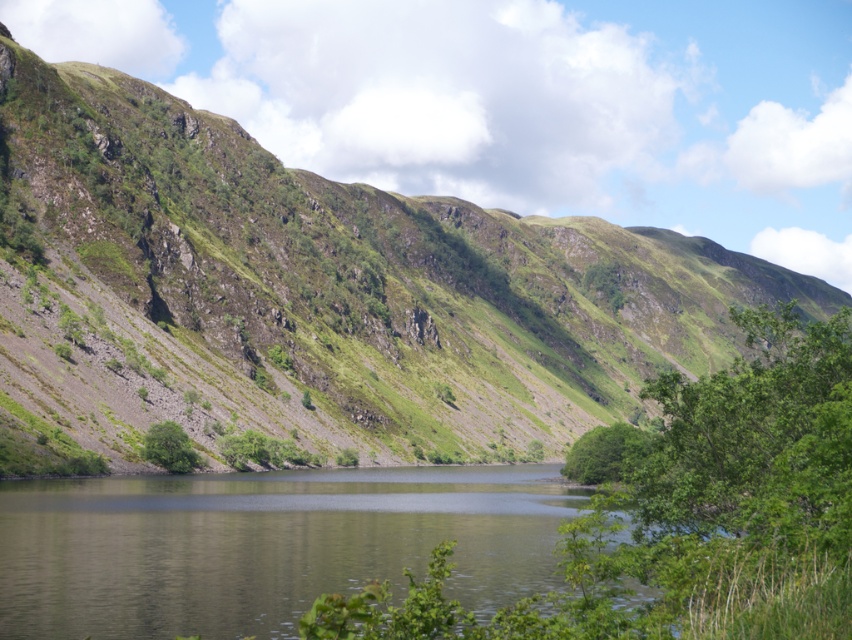
Is green grassy hillside at center closer to camera compared to green leafy tree at lower left?

That is True.

Locate an element on the screen. The width and height of the screenshot is (852, 640). green grassy hillside at center is located at coordinates (314, 296).

Which is in front, point (458, 531) or point (609, 461)?

Point (458, 531) is in front.

Does greenish water at center have a larger size compared to green leafy tree at center?

Actually, greenish water at center might be smaller than green leafy tree at center.

Who is more forward, (x=39, y=532) or (x=619, y=451)?

Positioned in front is point (x=39, y=532).

Identify the location of greenish water at center. The height and width of the screenshot is (640, 852). (266, 545).

Is green grassy hillside at center below greenish water at center?

Actually, green grassy hillside at center is above greenish water at center.

Who is more distant from viewer, (822,316) or (334,477)?

Positioned behind is point (822,316).

Find the location of a particular element. green grassy hillside at center is located at coordinates (314, 296).